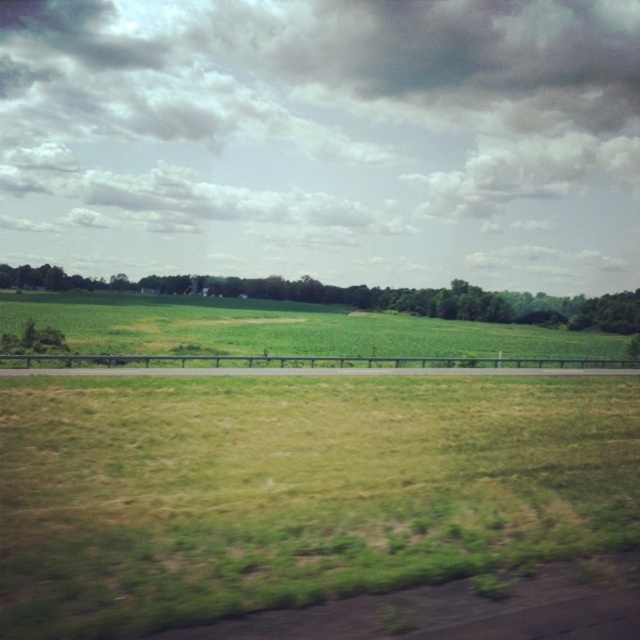
Question: Is green grassy field at lower center above green leafy tree at center?

Choices:
 (A) no
 (B) yes

Answer: (A)

Question: Which point is closer to the camera taking this photo?

Choices:
 (A) (122, 285)
 (B) (106, 417)

Answer: (B)

Question: Which object is closer to the camera taking this photo?

Choices:
 (A) green grassy field at lower center
 (B) green leafy tree at center

Answer: (A)

Question: Does green grassy field at lower center have a larger size compared to green leafy tree at center?

Choices:
 (A) yes
 (B) no

Answer: (B)

Question: Where is green grassy field at lower center located in relation to green leafy tree at center in the image?

Choices:
 (A) above
 (B) below

Answer: (B)

Question: Among these points, which one is farthest from the camera?

Choices:
 (A) (292, 296)
 (B) (237, 408)

Answer: (A)